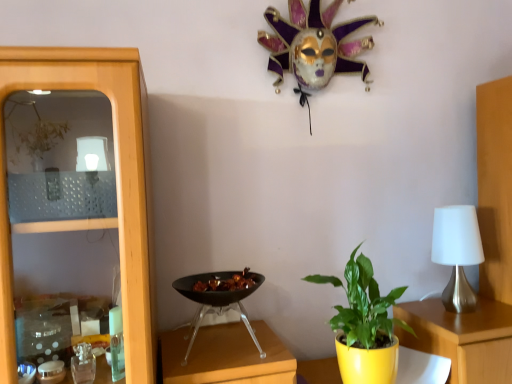
Question: Can you confirm if green glossy leafy plant at center is smaller than black glossy wok at center?

Choices:
 (A) yes
 (B) no

Answer: (B)

Question: Would you consider green glossy leafy plant at center to be distant from black glossy wok at center?

Choices:
 (A) yes
 (B) no

Answer: (B)

Question: Is green glossy leafy plant at center closer to camera compared to black glossy wok at center?

Choices:
 (A) yes
 (B) no

Answer: (B)

Question: From a real-world perspective, is green glossy leafy plant at center positioned under black glossy wok at center based on gravity?

Choices:
 (A) no
 (B) yes

Answer: (B)

Question: Is green glossy leafy plant at center positioned behind black glossy wok at center?

Choices:
 (A) yes
 (B) no

Answer: (A)

Question: Can we say green glossy leafy plant at center lies outside black glossy wok at center?

Choices:
 (A) no
 (B) yes

Answer: (B)

Question: Is black glossy wok at center located within satin silver table lamp at right?

Choices:
 (A) yes
 (B) no

Answer: (B)

Question: Is satin silver table lamp at right further to camera compared to black glossy wok at center?

Choices:
 (A) no
 (B) yes

Answer: (B)

Question: From the image's perspective, would you say satin silver table lamp at right is shown under black glossy wok at center?

Choices:
 (A) yes
 (B) no

Answer: (B)

Question: Is satin silver table lamp at right aimed at black glossy wok at center?

Choices:
 (A) no
 (B) yes

Answer: (A)

Question: Can you confirm if satin silver table lamp at right is wider than black glossy wok at center?

Choices:
 (A) no
 (B) yes

Answer: (A)

Question: Is satin silver table lamp at right to the right of black glossy wok at center from the viewer's perspective?

Choices:
 (A) no
 (B) yes

Answer: (B)

Question: From a real-world perspective, is green glossy leafy plant at center beneath satin silver table lamp at right?

Choices:
 (A) yes
 (B) no

Answer: (A)